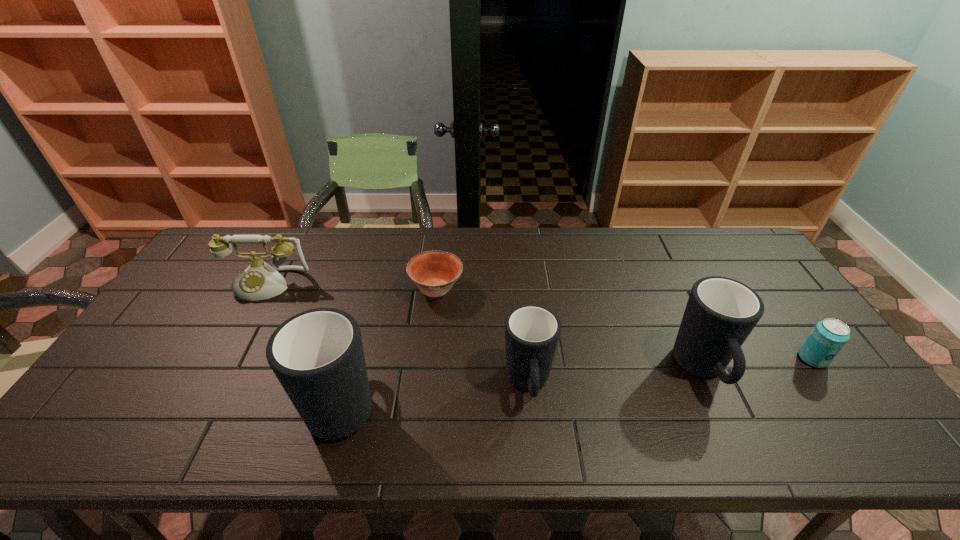
You are a GUI agent. You are given a task and a screenshot of the screen. Output one action in this format:
    pyautogui.click(x=<x>, y=<y>)
    Task: Click on the free spot between the bowl and the leftmost object
    
    Given the screenshot: What is the action you would take?
    pyautogui.click(x=352, y=287)

Identify the location of free area in between the beer can and the bowl. (625, 324).

Find the location of a particular element. vacant area that lies between the telephone and the third object from left to right is located at coordinates (352, 287).

Where is `vacant area between the beer can and the fifth object from right to left`? This screenshot has width=960, height=540. vacant area between the beer can and the fifth object from right to left is located at coordinates (578, 379).

This screenshot has width=960, height=540. Identify the location of free space that is in between the second shortest mug and the second mug from right to left. click(615, 377).

The width and height of the screenshot is (960, 540). In order to click on vacant area between the fifth tallest object and the shortest object in this screenshot , I will do `click(625, 324)`.

Identify which object is the fifth nearest to the leftmost mug. Please provide its 2D coordinates. Your answer should be formatted as a tuple, i.e. [(x, y)], where the tuple contains the x and y coordinates of a point satisfying the conditions above.

[(828, 337)]

Locate which object is the fifth closest to the fifth tallest object. Please provide its 2D coordinates. Your answer should be formatted as a tuple, i.e. [(x, y)], where the tuple contains the x and y coordinates of a point satisfying the conditions above.

[(260, 281)]

Where is `mug that is the closest to the rightmost object`? This screenshot has height=540, width=960. mug that is the closest to the rightmost object is located at coordinates (721, 312).

Identify which mug is located as the second nearest to the fifth tallest object. Please provide its 2D coordinates. Your answer should be formatted as a tuple, i.e. [(x, y)], where the tuple contains the x and y coordinates of a point satisfying the conditions above.

[(532, 332)]